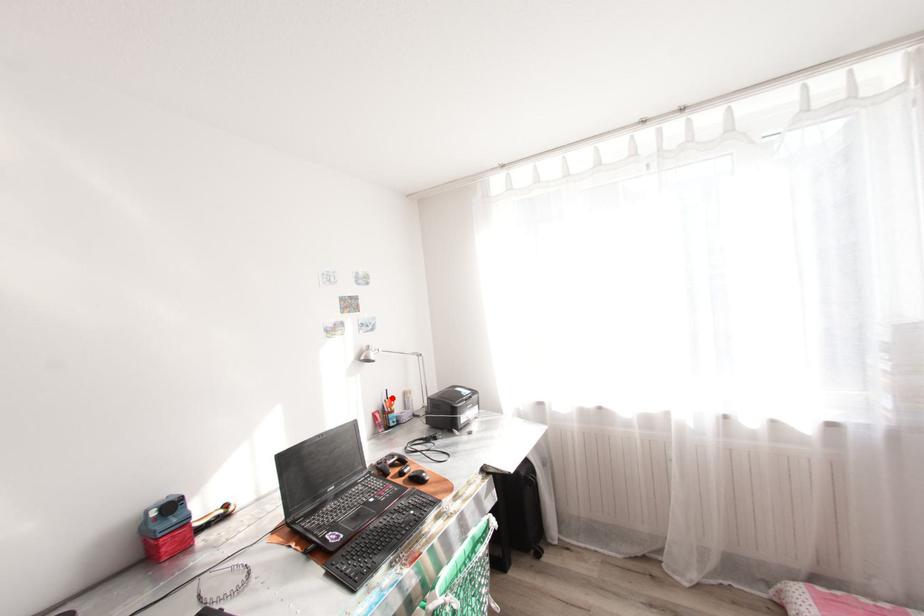
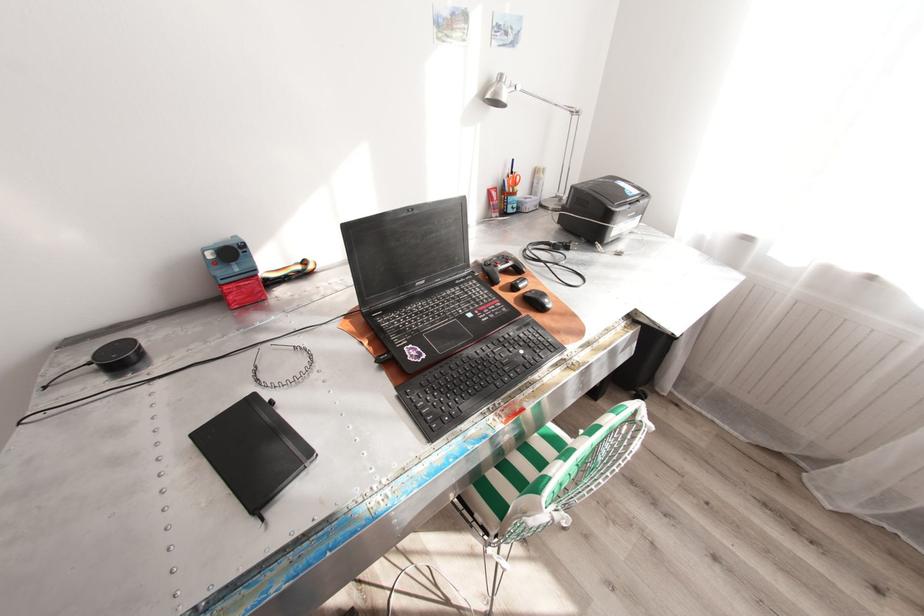
Locate, in the second image, the point that corresponds to the highlighted location in the first image.

(517, 172)